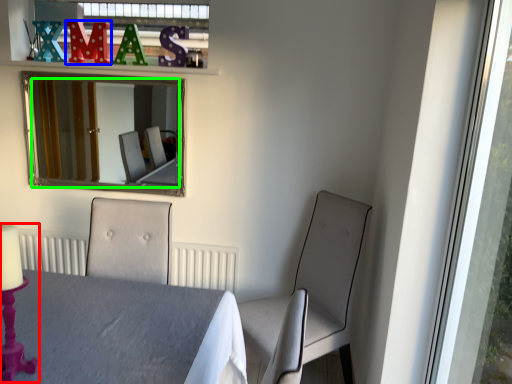
Question: Which object is the farthest from candle holder (highlighted by a red box)? Choose among these: alphabet (highlighted by a blue box) or mirror (highlighted by a green box).

Choices:
 (A) alphabet
 (B) mirror

Answer: (B)